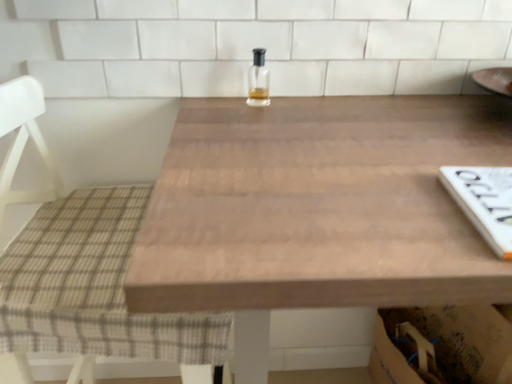
Question: Looking at their shapes, would you say plaid fabric chair at left is wider or thinner than wooden table at center?

Choices:
 (A) thin
 (B) wide

Answer: (A)

Question: From the image's perspective, relative to wooden table at center, is plaid fabric chair at left above or below?

Choices:
 (A) below
 (B) above

Answer: (B)

Question: Estimate the real-world distances between objects in this image. Which object is closer to the wooden table at center?

Choices:
 (A) clear glass bottle at center
 (B) plaid fabric chair at left

Answer: (B)

Question: Which is nearer to the wooden table at center?

Choices:
 (A) plaid fabric chair at left
 (B) clear glass bottle at center

Answer: (A)